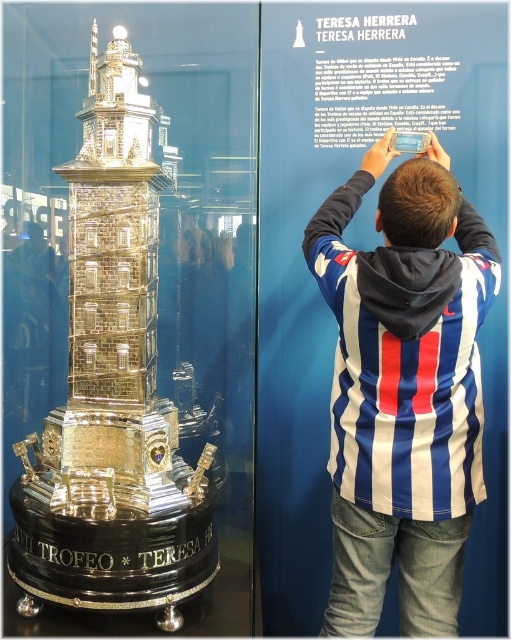
Question: Is the position of blue striped hoodie at upper center more distant than that of gold plated tower at center?

Choices:
 (A) no
 (B) yes

Answer: (A)

Question: Which of the following is the closest to the observer?

Choices:
 (A) (374, 531)
 (B) (94, 138)

Answer: (A)

Question: Is blue striped hoodie at upper center positioned before gold plated tower at center?

Choices:
 (A) yes
 (B) no

Answer: (A)

Question: Which point is farther to the camera?

Choices:
 (A) (436, 476)
 (B) (76, 604)

Answer: (B)

Question: Is blue striped hoodie at upper center positioned before gold plated tower at center?

Choices:
 (A) no
 (B) yes

Answer: (B)

Question: Which object appears closest to the camera in this image?

Choices:
 (A) gold plated tower at center
 (B) blue striped hoodie at upper center

Answer: (B)